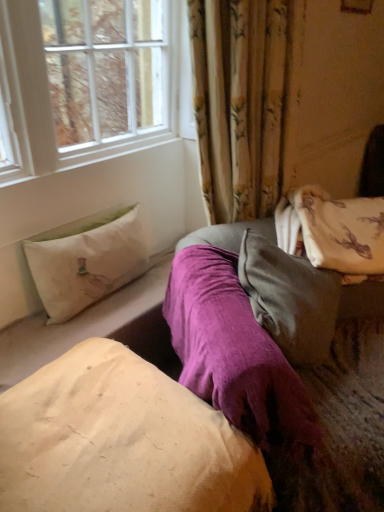
Question: Is white fabric pillow at left, placed as the 3th pillow when sorted from bottom to top, located within beige cotton pillow at center, which is the 3th pillow in top-to-bottom order?

Choices:
 (A) yes
 (B) no

Answer: (B)

Question: Can you confirm if beige cotton pillow at center, placed as the 1th pillow when sorted from bottom to top, is wider than white fabric pillow at left, which appears as the 1th pillow when viewed from the top?

Choices:
 (A) no
 (B) yes

Answer: (B)

Question: Does beige cotton pillow at center, placed as the 1th pillow when sorted from bottom to top, have a lesser width compared to white fabric pillow at left, placed as the 3th pillow when sorted from bottom to top?

Choices:
 (A) no
 (B) yes

Answer: (A)

Question: Is beige cotton pillow at center, placed as the 1th pillow when sorted from bottom to top, oriented away from white fabric pillow at left, which appears as the 1th pillow when viewed from the top?

Choices:
 (A) no
 (B) yes

Answer: (A)

Question: From the image's perspective, is beige cotton pillow at center, which is the 3th pillow in top-to-bottom order, on top of white fabric pillow at left, placed as the 3th pillow when sorted from bottom to top?

Choices:
 (A) yes
 (B) no

Answer: (B)

Question: Looking at the image, does beige cotton pillow at center, which is the 3th pillow in top-to-bottom order, seem bigger or smaller compared to velvety gray pillow at center, marked as the 2th pillow in a bottom-to-top arrangement?

Choices:
 (A) big
 (B) small

Answer: (A)

Question: Is beige cotton pillow at center, placed as the 1th pillow when sorted from bottom to top, in front of or behind velvety gray pillow at center, arranged as the 2th pillow when viewed from the top, in the image?

Choices:
 (A) front
 (B) behind

Answer: (A)

Question: In terms of width, does beige cotton pillow at center, placed as the 1th pillow when sorted from bottom to top, look wider or thinner when compared to velvety gray pillow at center, marked as the 2th pillow in a bottom-to-top arrangement?

Choices:
 (A) thin
 (B) wide

Answer: (B)

Question: From the image's perspective, is beige cotton pillow at center, placed as the 1th pillow when sorted from bottom to top, above or below velvety gray pillow at center, arranged as the 2th pillow when viewed from the top?

Choices:
 (A) below
 (B) above

Answer: (A)

Question: Considering the positions of white fabric pillow at left, which appears as the 1th pillow when viewed from the top, and velvety gray pillow at center, marked as the 2th pillow in a bottom-to-top arrangement, in the image, is white fabric pillow at left, which appears as the 1th pillow when viewed from the top, taller or shorter than velvety gray pillow at center, marked as the 2th pillow in a bottom-to-top arrangement,?

Choices:
 (A) tall
 (B) short

Answer: (B)

Question: From a real-world perspective, is white fabric pillow at left, placed as the 3th pillow when sorted from bottom to top, above or below velvety gray pillow at center, arranged as the 2th pillow when viewed from the top?

Choices:
 (A) above
 (B) below

Answer: (B)

Question: Considering their positions, is white fabric pillow at left, which appears as the 1th pillow when viewed from the top, located in front of or behind velvety gray pillow at center, arranged as the 2th pillow when viewed from the top?

Choices:
 (A) front
 (B) behind

Answer: (B)

Question: Which is correct: white fabric pillow at left, placed as the 3th pillow when sorted from bottom to top, is inside velvety gray pillow at center, arranged as the 2th pillow when viewed from the top, or outside of it?

Choices:
 (A) outside
 (B) inside

Answer: (A)

Question: In terms of width, does white fabric pillow at left, placed as the 3th pillow when sorted from bottom to top, look wider or thinner when compared to beige cotton pillow at center, which is the 3th pillow in top-to-bottom order?

Choices:
 (A) thin
 (B) wide

Answer: (A)

Question: Is white fabric pillow at left, which appears as the 1th pillow when viewed from the top, bigger or smaller than beige cotton pillow at center, which is the 3th pillow in top-to-bottom order?

Choices:
 (A) small
 (B) big

Answer: (A)